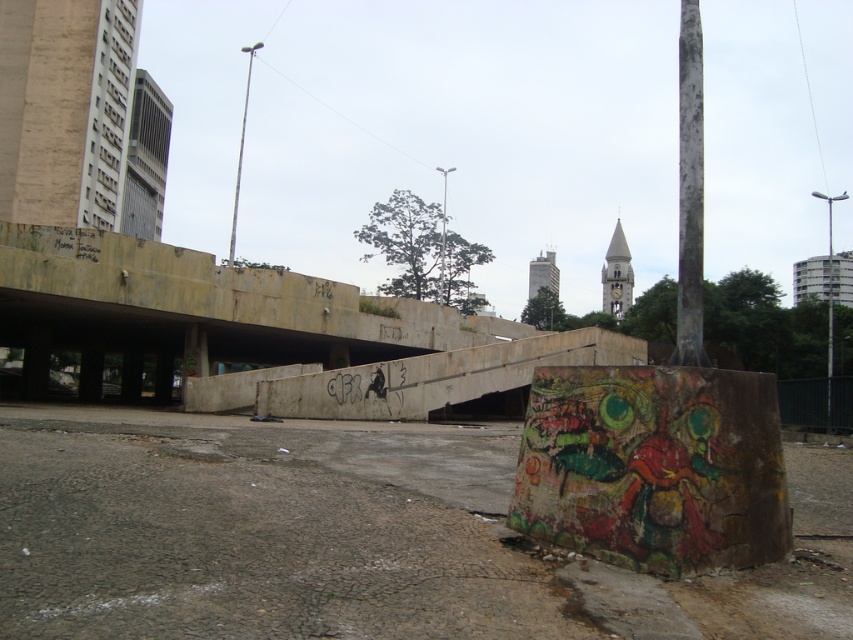
From the picture: Can you confirm if gray concrete building at upper left is positioned to the right of gray concrete tower at center?

Incorrect, gray concrete building at upper left is not on the right side of gray concrete tower at center.

Between point (160, 124) and point (527, 292), which one is positioned in front?

Point (160, 124) is more forward.

Describe the element at coordinates (146, 160) in the screenshot. I see `gray concrete building at upper left` at that location.

At what (x,y) coordinates should I click in order to perform the action: click on gray concrete building at upper left. Please return your answer as a coordinate pair (x, y). Image resolution: width=853 pixels, height=640 pixels. Looking at the image, I should click on (146, 160).

Does white stone clock tower at upper center have a greater height compared to silver metallic pole at upper center?

A: Incorrect, white stone clock tower at upper center's height is not larger of silver metallic pole at upper center's.

Which is below, white stone clock tower at upper center or silver metallic pole at upper center?

Positioned lower is white stone clock tower at upper center.

Between point (606, 260) and point (247, 99), which one is positioned behind?

The point (247, 99) is more distant.

Locate an element on the screen. white stone clock tower at upper center is located at coordinates (618, 275).

Who is higher up, beige stone building at upper left or gray concrete building at upper left?

beige stone building at upper left is above.

Is point (57, 132) farther from camera compared to point (160, 163)?

No, (57, 132) is in front of (160, 163).

Find the location of `beige stone building at upper left`. beige stone building at upper left is located at coordinates (65, 108).